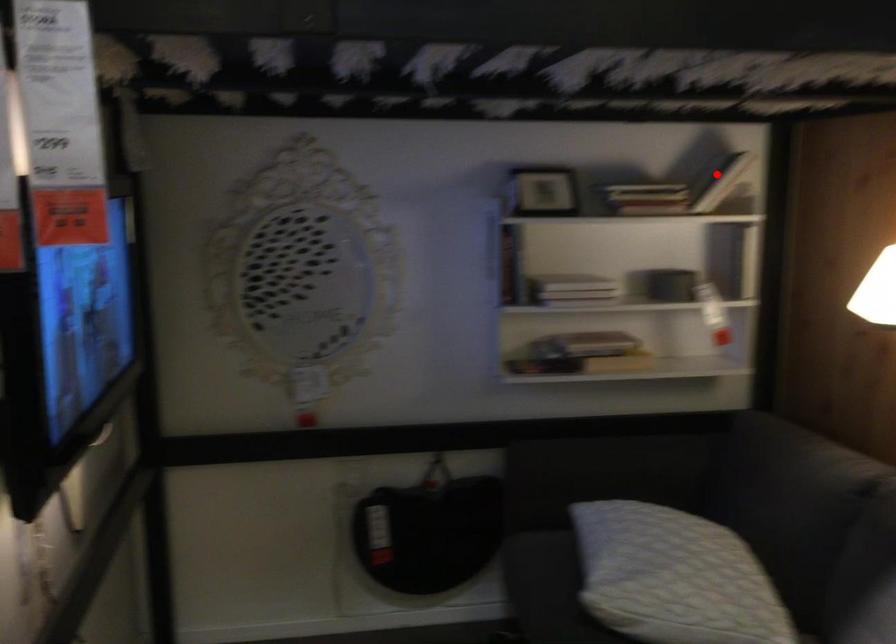
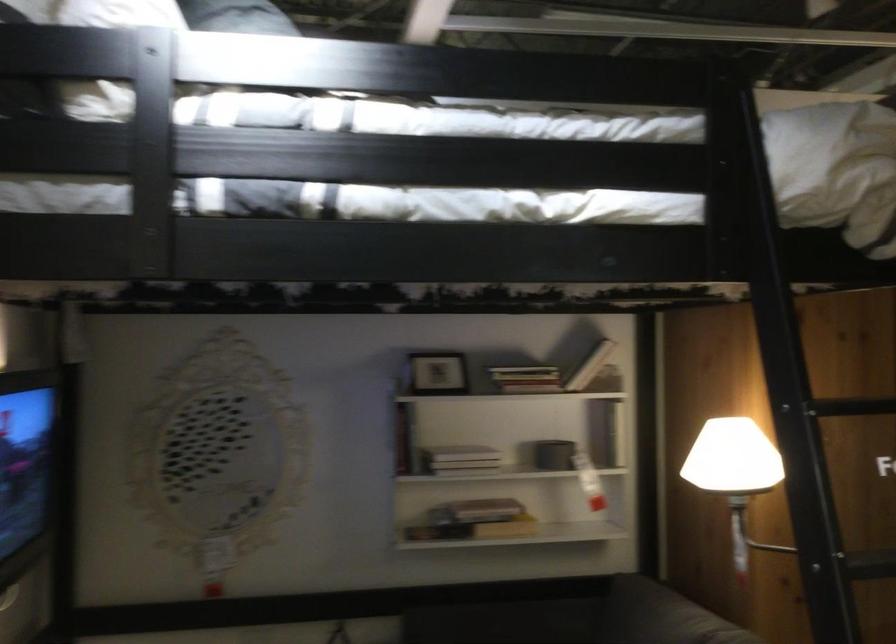
The point at the highlighted location is marked in the first image. Where is the corresponding point in the second image?

(590, 366)